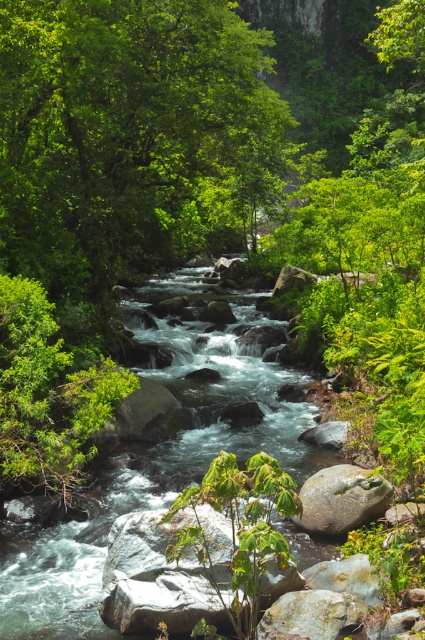
Question: Which point is farther to the camera?

Choices:
 (A) green leafy tree at left
 (B) rusty metallic rock at center
 (C) gray smooth rock at center-right

Answer: (C)

Question: Which point is farther to the camera?

Choices:
 (A) rusty metallic rock at center
 (B) green leafy tree at left

Answer: (B)

Question: Does green leafy tree at left have a greater width compared to gray smooth rock at center-right?

Choices:
 (A) yes
 (B) no

Answer: (A)

Question: Which point is farther from the camera taking this photo?

Choices:
 (A) (x=320, y=592)
 (B) (x=116, y=381)

Answer: (B)

Question: Does green leafy tree at left have a greater width compared to gray smooth rock at center-right?

Choices:
 (A) yes
 (B) no

Answer: (A)

Question: Can you confirm if green leafy tree at left is positioned to the left of rusty metallic rock at center?

Choices:
 (A) yes
 (B) no

Answer: (A)